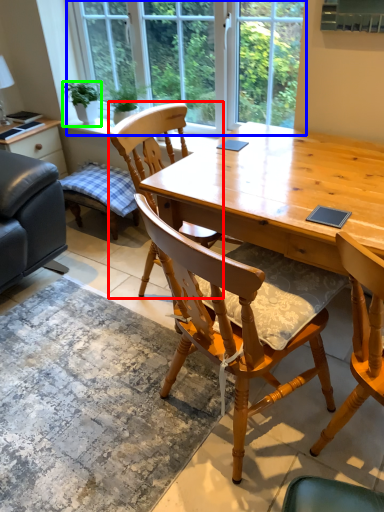
Question: Estimate the real-world distances between objects in this image. Which object is farther from chair (highlighted by a red box), window (highlighted by a blue box) or houseplant (highlighted by a green box)?

Choices:
 (A) window
 (B) houseplant

Answer: (B)